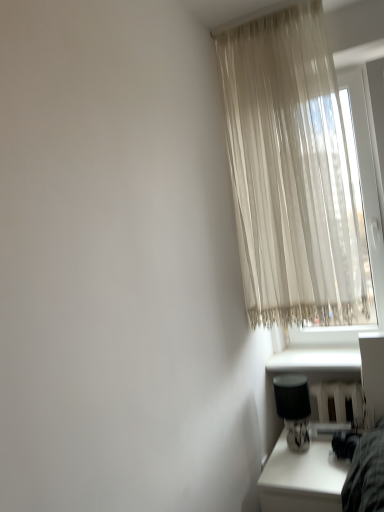
What is the approximate width of white glossy table at lower right?

white glossy table at lower right is 19.98 inches wide.

At what (x,y) coordinates should I click in order to perform the action: click on white glossy table at lower right. Please return your answer as a coordinate pair (x, y). The image size is (384, 512). Looking at the image, I should click on (302, 478).

Identify the location of white smooth window sill at lower right. (317, 361).

Looking at this image, is white smooth window sill at lower right positioned with its back to white glossy table at lower right?

white smooth window sill at lower right does not have its back to white glossy table at lower right.

Between point (315, 348) and point (328, 506), which one is positioned in front?

The point (328, 506) is in front.

Is white smooth window sill at lower right directly adjacent to white glossy table at lower right?

white smooth window sill at lower right is not next to white glossy table at lower right, and they're not touching.

Is white glossy table at lower right inside white smooth window sill at lower right?

Actually, white glossy table at lower right is outside white smooth window sill at lower right.

In the scene shown: Is white smooth window sill at lower right looking in the opposite direction of black fabric table lamp at lower right?

white smooth window sill at lower right does not have its back to black fabric table lamp at lower right.

Is point (338, 359) positioned before point (290, 397)?

No, (338, 359) is further to viewer.

Is white smooth window sill at lower right wider than black fabric table lamp at lower right?

Correct, the width of white smooth window sill at lower right exceeds that of black fabric table lamp at lower right.

Is white smooth window sill at lower right spatially inside black fabric table lamp at lower right, or outside of it?

white smooth window sill at lower right is located beyond the bounds of black fabric table lamp at lower right.

Is sheer beige curtain at upper right to the left of white smooth window sill at lower right from the viewer's perspective?

Yes, sheer beige curtain at upper right is to the left of white smooth window sill at lower right.

Looking at this image, is sheer beige curtain at upper right beside white smooth window sill at lower right?

No, sheer beige curtain at upper right is not next to white smooth window sill at lower right.

Consider the image. Which object is wider, sheer beige curtain at upper right or white smooth window sill at lower right?

With larger width is white smooth window sill at lower right.

Would you say white smooth window sill at lower right is part of sheer beige curtain at upper right's contents?

No, white smooth window sill at lower right is not a part of sheer beige curtain at upper right.

Can white glossy table at lower right be found inside sheer beige curtain at upper right?

No, white glossy table at lower right is not a part of sheer beige curtain at upper right.

Is sheer beige curtain at upper right to the left of white glossy table at lower right from the viewer's perspective?

Indeed, sheer beige curtain at upper right is positioned on the left side of white glossy table at lower right.

Which object is wider, sheer beige curtain at upper right or white glossy table at lower right?

white glossy table at lower right.

Would you say sheer beige curtain at upper right is a long distance from white glossy table at lower right?

sheer beige curtain at upper right is near white glossy table at lower right, not far away.

Does black fabric table lamp at lower right have a greater height compared to white smooth window sill at lower right?

Correct, black fabric table lamp at lower right is much taller as white smooth window sill at lower right.

Considering the relative positions of black fabric table lamp at lower right and white smooth window sill at lower right in the image provided, is black fabric table lamp at lower right to the right of white smooth window sill at lower right from the viewer's perspective?

In fact, black fabric table lamp at lower right is to the left of white smooth window sill at lower right.

In the image, is black fabric table lamp at lower right positioned in front of or behind white smooth window sill at lower right?

Clearly, black fabric table lamp at lower right is in front of white smooth window sill at lower right.

Where is `table on the left of white smooth window sill at lower right`? table on the left of white smooth window sill at lower right is located at coordinates (302, 478).

From the picture: Does white glossy table at lower right turn towards white smooth window sill at lower right?

No.

Does point (291, 487) come farther from viewer compared to point (303, 362)?

That is False.

Considering the relative sizes of sheer beige curtain at upper right and black fabric table lamp at lower right in the image provided, is sheer beige curtain at upper right smaller than black fabric table lamp at lower right?

Incorrect, sheer beige curtain at upper right is not smaller in size than black fabric table lamp at lower right.

Which is more to the left, sheer beige curtain at upper right or black fabric table lamp at lower right?

sheer beige curtain at upper right.

From a real-world perspective, who is located lower, sheer beige curtain at upper right or black fabric table lamp at lower right?

black fabric table lamp at lower right.

This screenshot has width=384, height=512. Find the location of `table below the white smooth window sill at lower right (from a real-world perspective)`. table below the white smooth window sill at lower right (from a real-world perspective) is located at coordinates (302, 478).

Find the location of a particular element. This screenshot has width=384, height=512. table lamp located in front of the white smooth window sill at lower right is located at coordinates (294, 408).

Estimate the real-world distances between objects in this image. Which object is closer to white smooth window sill at lower right, sheer beige curtain at upper right or black fabric table lamp at lower right?

Based on the image, black fabric table lamp at lower right appears to be nearer to white smooth window sill at lower right.

Looking at this image, based on their spatial positions, is white smooth window sill at lower right or sheer beige curtain at upper right further from white glossy table at lower right?

sheer beige curtain at upper right is further to white glossy table at lower right.

Which object lies nearer to the anchor point sheer beige curtain at upper right, white smooth window sill at lower right or black fabric table lamp at lower right?

Based on the image, white smooth window sill at lower right appears to be nearer to sheer beige curtain at upper right.

When comparing their distances from sheer beige curtain at upper right, does white glossy table at lower right or black fabric table lamp at lower right seem closer?

black fabric table lamp at lower right.

Estimate the real-world distances between objects in this image. Which object is further from black fabric table lamp at lower right, sheer beige curtain at upper right or white glossy table at lower right?

sheer beige curtain at upper right.

Considering their positions, is black fabric table lamp at lower right positioned closer to sheer beige curtain at upper right than white glossy table at lower right?

black fabric table lamp at lower right is positioned closer to the anchor sheer beige curtain at upper right.

Based on their spatial positions, is white glossy table at lower right or black fabric table lamp at lower right closer to white smooth window sill at lower right?

black fabric table lamp at lower right.

When comparing their distances from white smooth window sill at lower right, does black fabric table lamp at lower right or white glossy table at lower right seem closer?

black fabric table lamp at lower right.

The image size is (384, 512). Find the location of `table lamp between sheer beige curtain at upper right and white glossy table at lower right from top to bottom`. table lamp between sheer beige curtain at upper right and white glossy table at lower right from top to bottom is located at coordinates (294, 408).

Find the location of a particular element. The height and width of the screenshot is (512, 384). table lamp that lies between white smooth window sill at lower right and white glossy table at lower right from top to bottom is located at coordinates (294, 408).

Image resolution: width=384 pixels, height=512 pixels. Find the location of `window sill between sheer beige curtain at upper right and white glossy table at lower right in the vertical direction`. window sill between sheer beige curtain at upper right and white glossy table at lower right in the vertical direction is located at coordinates (317, 361).

In order to click on window sill between sheer beige curtain at upper right and black fabric table lamp at lower right in the up-down direction in this screenshot , I will do `click(317, 361)`.